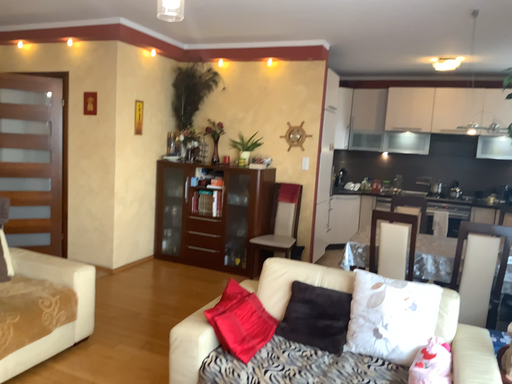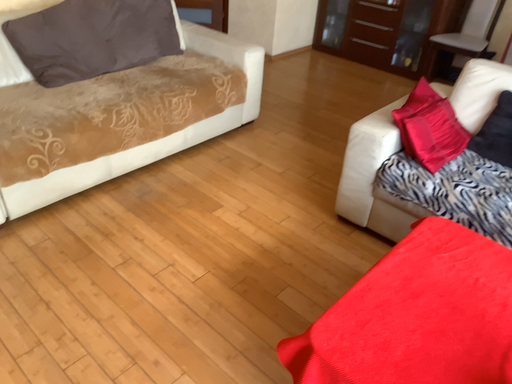
Question: How did the camera likely rotate when shooting the video?

Choices:
 (A) rotated left
 (B) rotated right

Answer: (A)